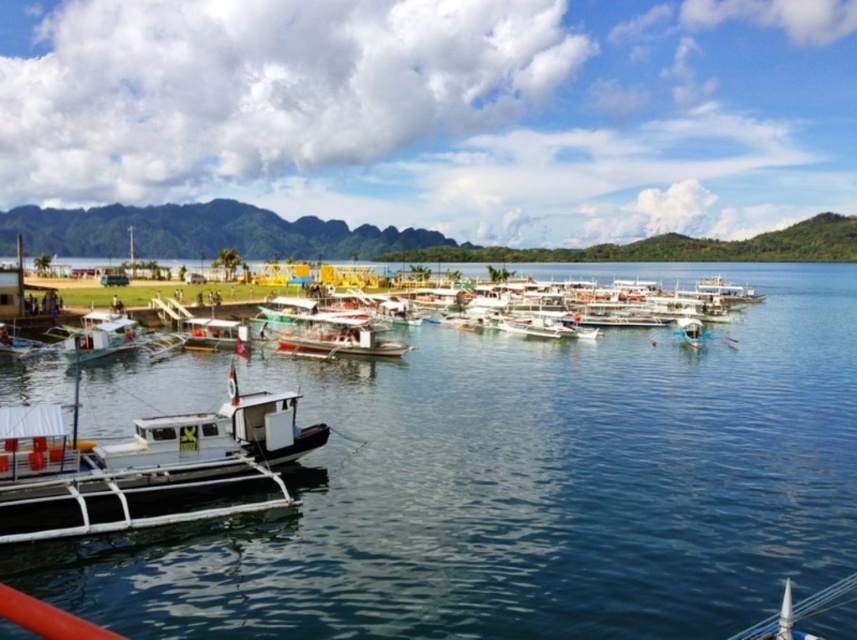
You are a photographer planning to take a wide shot of the scene. You want to ensure that both the clear blue water at center and the white wooden boat at center are fully visible in the frame. Given their sizes, which object will occupy more of the space in your photo?

The clear blue water at center is larger in size than the white wooden boat at center, so it will occupy more space in the photo.

You are a tourist standing at the edge of the pier and want to take a photo of the white wooden boat at center. If you move 0.1 units to the right along the pier, will the boat still be in your camera frame? Assume your camera has a field of view that covers from 0.4 to 0.6 on the horizontal axis.

The white wooden boat at center is located at point 0.528 on the horizontal axis. Moving 0.1 units to the right would place you at 0.628. Since the camera frame covers up to 0.6, the boat will be slightly out of the frame to the left. Therefore, the boat will not be fully in the camera frame anymore.

You are a photographer planning to take a photo of the white wooden boat at center and the white matte boat at left from the pier. Which boat will appear taller in your photo?

The white matte boat at left will appear taller in the photo because the white wooden boat at center is not as tall as the white matte boat at left.